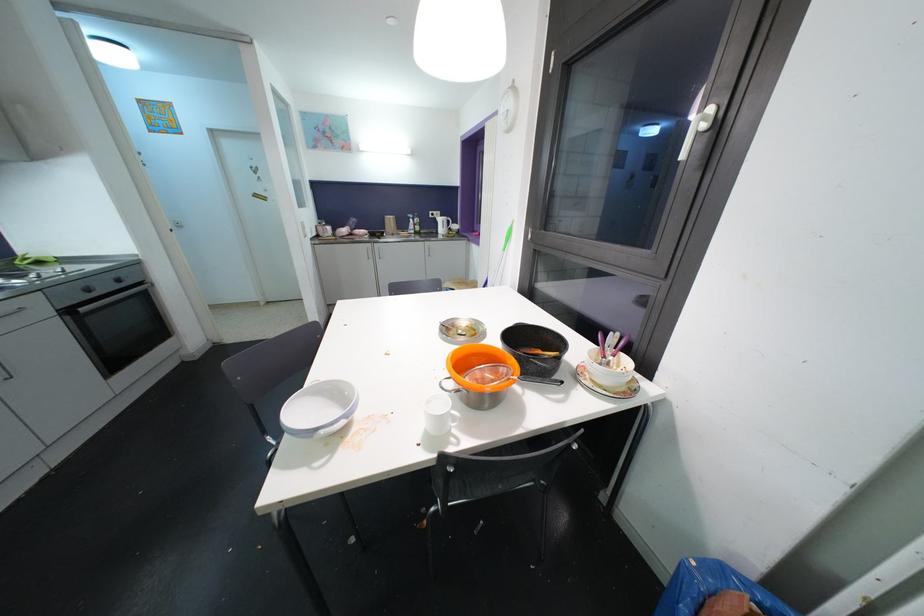
Identify the location of white mug handle. The image size is (924, 616). (455, 419).